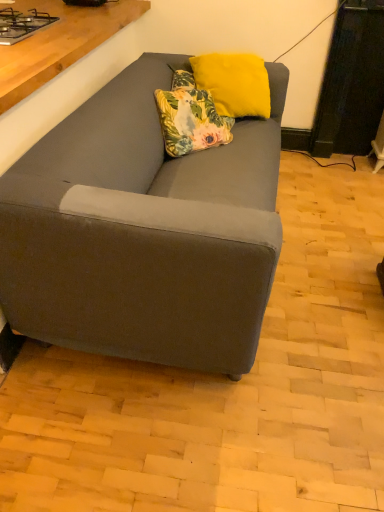
Question: From a real-world perspective, is floral fabric pillow at center, placed as the 1th pillow when sorted from bottom to top, below metallic gray gas stove at upper left?

Choices:
 (A) yes
 (B) no

Answer: (A)

Question: Does floral fabric pillow at center, placed as the 1th pillow when sorted from bottom to top, have a lesser width compared to metallic gray gas stove at upper left?

Choices:
 (A) no
 (B) yes

Answer: (B)

Question: Is floral fabric pillow at center, placed as the 2th pillow when sorted from top to bottom, looking in the opposite direction of metallic gray gas stove at upper left?

Choices:
 (A) yes
 (B) no

Answer: (B)

Question: Can you confirm if floral fabric pillow at center, placed as the 2th pillow when sorted from top to bottom, is positioned to the left of metallic gray gas stove at upper left?

Choices:
 (A) yes
 (B) no

Answer: (B)

Question: Is floral fabric pillow at center, placed as the 1th pillow when sorted from bottom to top, closer to the viewer compared to metallic gray gas stove at upper left?

Choices:
 (A) yes
 (B) no

Answer: (B)

Question: From the image's perspective, is metallic gray gas stove at upper left positioned above or below yellow fuzzy pillow at upper center, which is the 1th pillow in top-to-bottom order?

Choices:
 (A) above
 (B) below

Answer: (A)

Question: From a real-world perspective, relative to yellow fuzzy pillow at upper center, the second pillow ordered from the bottom, is metallic gray gas stove at upper left vertically above or below?

Choices:
 (A) above
 (B) below

Answer: (A)

Question: Is point (34, 10) positioned closer to the camera than point (216, 72)?

Choices:
 (A) farther
 (B) closer

Answer: (B)

Question: Considering the positions of metallic gray gas stove at upper left and yellow fuzzy pillow at upper center, which is the 1th pillow in top-to-bottom order, in the image, is metallic gray gas stove at upper left bigger or smaller than yellow fuzzy pillow at upper center, which is the 1th pillow in top-to-bottom order,?

Choices:
 (A) small
 (B) big

Answer: (A)

Question: Is point (223, 143) positioned closer to the camera than point (24, 25)?

Choices:
 (A) farther
 (B) closer

Answer: (A)

Question: In the image, is floral fabric pillow at center, placed as the 1th pillow when sorted from bottom to top, on the left side or the right side of metallic gray gas stove at upper left?

Choices:
 (A) left
 (B) right

Answer: (B)

Question: From the image's perspective, is floral fabric pillow at center, placed as the 1th pillow when sorted from bottom to top, located above or below metallic gray gas stove at upper left?

Choices:
 (A) above
 (B) below

Answer: (B)

Question: Is floral fabric pillow at center, placed as the 1th pillow when sorted from bottom to top, bigger or smaller than metallic gray gas stove at upper left?

Choices:
 (A) big
 (B) small

Answer: (A)

Question: Is point (200, 108) positioned closer to the camera than point (203, 66)?

Choices:
 (A) farther
 (B) closer

Answer: (B)

Question: Is floral fabric pillow at center, placed as the 2th pillow when sorted from top to bottom, bigger or smaller than yellow fuzzy pillow at upper center, the second pillow ordered from the bottom?

Choices:
 (A) small
 (B) big

Answer: (A)